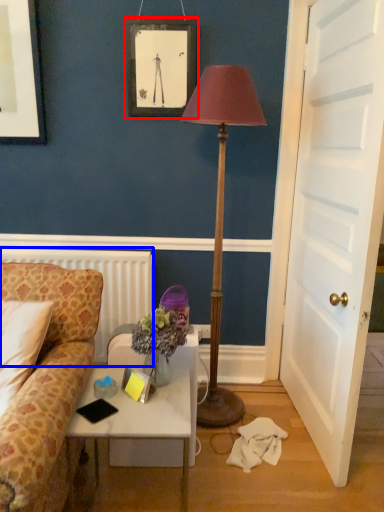
Question: Which point is closer to the camera, picture frame (highlighted by a red box) or radiator (highlighted by a blue box)?

Choices:
 (A) picture frame
 (B) radiator

Answer: (A)